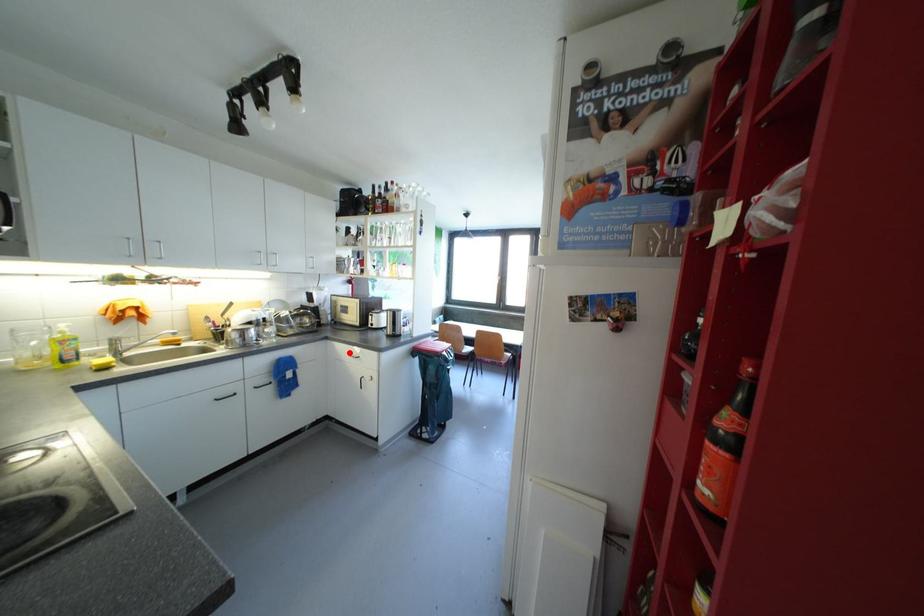
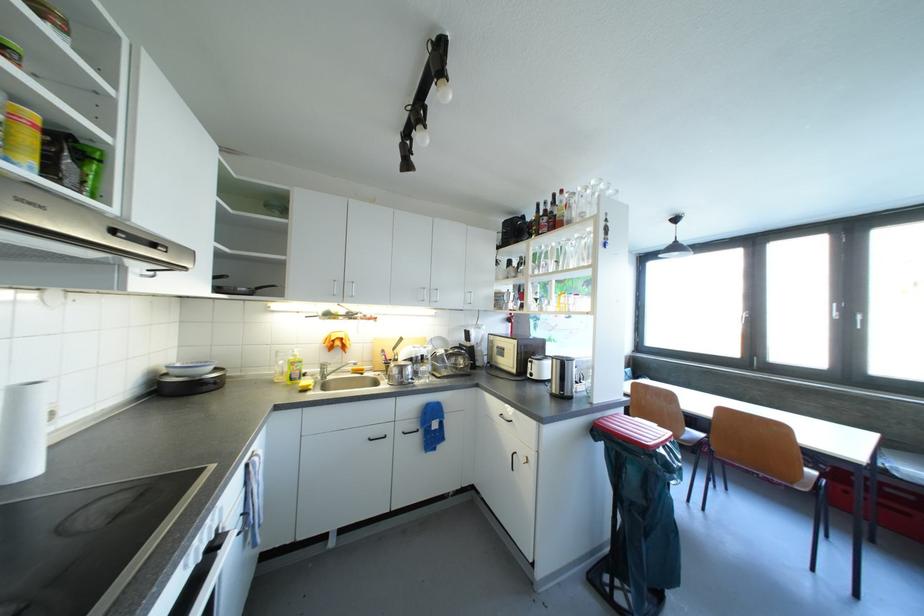
Where in the second image is the point corresponding to the highlighted location from the first image?

(500, 408)